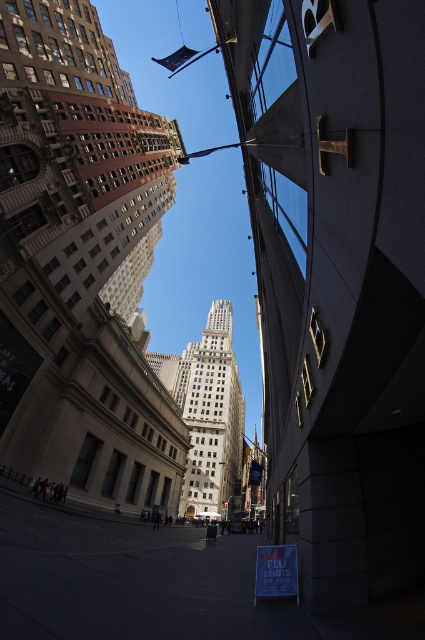
Does dark gray concrete skyscraper at center have a lesser height compared to brown stone skyscraper at center?

Correct, dark gray concrete skyscraper at center is not as tall as brown stone skyscraper at center.

Does point (286, 541) come closer to viewer compared to point (161, 428)?

Yes, it is in front of point (161, 428).

Find the location of a particular element. dark gray concrete skyscraper at center is located at coordinates (337, 278).

Who is positioned more to the right, brown stone skyscraper at center or white marble tower at center?

Positioned to the right is white marble tower at center.

In the scene shown: Is brown stone skyscraper at center wider than white marble tower at center?

No, brown stone skyscraper at center is not wider than white marble tower at center.

Locate an element on the screen. This screenshot has width=425, height=640. brown stone skyscraper at center is located at coordinates (82, 294).

Locate an element on the screen. brown stone skyscraper at center is located at coordinates (82, 294).

Is dark gray concrete skyscraper at center shorter than white marble tower at center?

In fact, dark gray concrete skyscraper at center may be taller than white marble tower at center.

Is dark gray concrete skyscraper at center behind white marble tower at center?

That is False.

Who is more distant from viewer, (280, 420) or (238, 486)?

Positioned behind is point (238, 486).

Identify the location of dark gray concrete skyscraper at center. The image size is (425, 640). (337, 278).